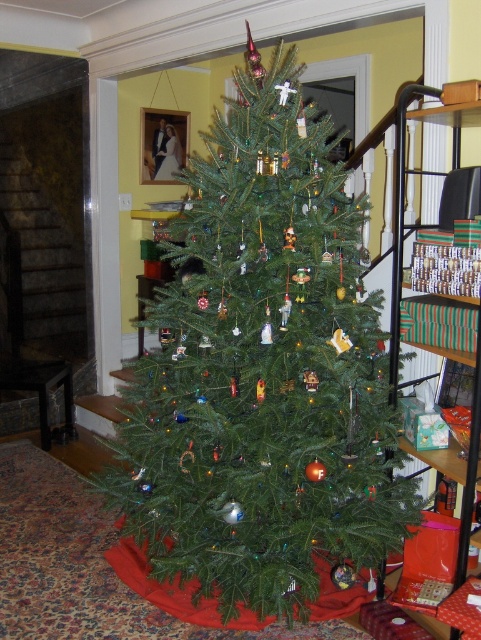
You are standing in front of the Christmas tree and notice the green matte christmas tree at center and the green striped fabric at right. Which object is positioned lower in the image?

The green matte christmas tree at center is positioned lower than the green striped fabric at right.

You are standing in front of the Christmas tree and want to place a gift under it. The gift needs to be placed between the green matte christmas tree at center and the green striped fabric at right. Can you do that?

Yes, you can place the gift between the green matte christmas tree at center and the green striped fabric at right since the tree is to the left of the fabric.